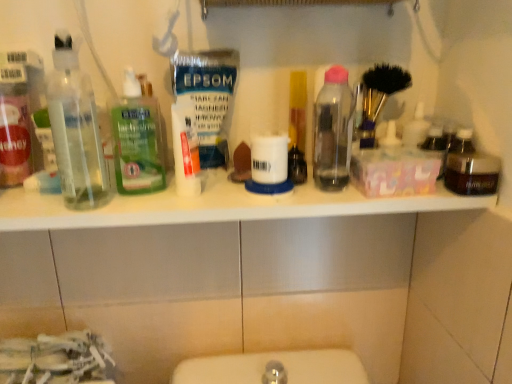
Question: Is translucent plastic bottle at center positioned far away from transparent plastic bottles at left, which appears as the first bottle when viewed from the left?

Choices:
 (A) yes
 (B) no

Answer: (B)

Question: Can you confirm if translucent plastic bottle at center is thinner than transparent plastic bottles at left, positioned as the fourth bottle in right-to-left order?

Choices:
 (A) no
 (B) yes

Answer: (A)

Question: Does translucent plastic bottle at center appear on the left side of transparent plastic bottles at left, positioned as the fourth bottle in right-to-left order?

Choices:
 (A) no
 (B) yes

Answer: (A)

Question: Is translucent plastic bottle at center bigger than transparent plastic bottles at left, positioned as the fourth bottle in right-to-left order?

Choices:
 (A) no
 (B) yes

Answer: (A)

Question: Does translucent plastic bottle at center contain transparent plastic bottles at left, which appears as the first bottle when viewed from the left?

Choices:
 (A) yes
 (B) no

Answer: (B)

Question: In terms of height, does white plastic shelf at upper center look taller or shorter compared to transparent plastic bottle at center, which is the second bottle from right to left?

Choices:
 (A) tall
 (B) short

Answer: (B)

Question: Which is correct: white plastic shelf at upper center is inside transparent plastic bottle at center, arranged as the third bottle when viewed from the left, or outside of it?

Choices:
 (A) inside
 (B) outside

Answer: (B)

Question: Looking at their shapes, would you say white plastic shelf at upper center is wider or thinner than transparent plastic bottle at center, arranged as the third bottle when viewed from the left?

Choices:
 (A) thin
 (B) wide

Answer: (B)

Question: Does point (154, 198) appear closer or farther from the camera than point (339, 137)?

Choices:
 (A) farther
 (B) closer

Answer: (B)

Question: Considering their positions, is translucent plastic bottle at center located in front of or behind dark brown glass jar at right, which is counted as the 4th bottle, starting from the left?

Choices:
 (A) front
 (B) behind

Answer: (B)

Question: Is point (298, 132) positioned closer to the camera than point (494, 155)?

Choices:
 (A) closer
 (B) farther

Answer: (B)

Question: From the image's perspective, relative to dark brown glass jar at right, which is counted as the 4th bottle, starting from the left, is translucent plastic bottle at center above or below?

Choices:
 (A) above
 (B) below

Answer: (A)

Question: From a real-world perspective, is translucent plastic bottle at center physically located above or below dark brown glass jar at right, the first bottle viewed from the right?

Choices:
 (A) below
 (B) above

Answer: (B)

Question: Is white plastic shelf at upper center wider or thinner than green translucent liquid at center, which appears as the 3th bottle when viewed from the right?

Choices:
 (A) thin
 (B) wide

Answer: (B)

Question: From a real-world perspective, is white plastic shelf at upper center physically located above or below green translucent liquid at center, arranged as the second bottle when viewed from the left?

Choices:
 (A) above
 (B) below

Answer: (B)